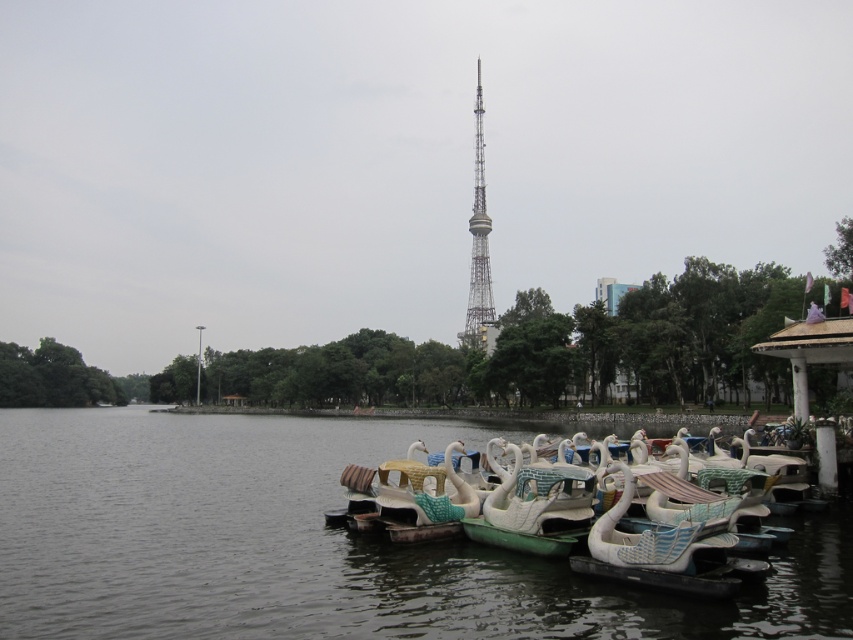
Question: Does transparent plastic water at lower right appear on the right side of metallic lattice tower at center?

Choices:
 (A) no
 (B) yes

Answer: (A)

Question: Does transparent plastic water at lower right have a larger size compared to metallic lattice tower at center?

Choices:
 (A) no
 (B) yes

Answer: (A)

Question: Which point appears farthest from the camera in this image?

Choices:
 (A) (320, 504)
 (B) (482, 314)

Answer: (B)

Question: Which of the following is the closest to the observer?

Choices:
 (A) transparent plastic water at lower right
 (B) metallic lattice tower at center

Answer: (A)

Question: In this image, where is transparent plastic water at lower right located relative to metallic lattice tower at center?

Choices:
 (A) right
 (B) left

Answer: (B)